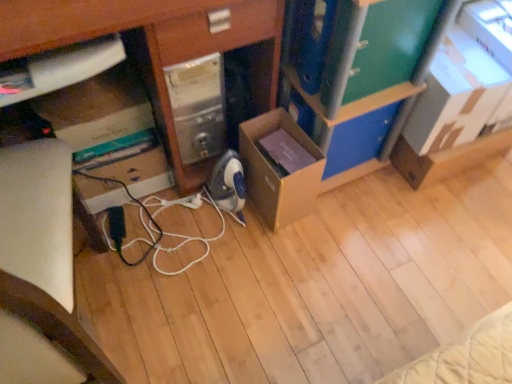
Question: Is point (343, 170) closer or farther from the camera than point (409, 84)?

Choices:
 (A) farther
 (B) closer

Answer: (A)

Question: In the image, is blue plastic drawer at center, which ranks as the second drawer in top-to-bottom order, on the left side or the right side of green matte bookshelf at upper right?

Choices:
 (A) right
 (B) left

Answer: (A)

Question: Estimate the real-world distances between objects in this image. Which object is closer to the black rubber cable at center?

Choices:
 (A) brown cardboard box at center, positioned as the second cardboard box in right-to-left order
 (B) blue plastic drawer at center, the second drawer from the front
 (C) matte cardboard box at lower left
 (D) cardboard box at upper right, the first cardboard box from the right
 (E) green matte bookshelf at upper right

Answer: (A)

Question: Which of these objects is positioned farthest from the blue plastic drawer at center, the second drawer from the front?

Choices:
 (A) green matte bookshelf at upper right
 (B) black rubber cable at center
 (C) matte cardboard box at lower left
 (D) green matte drawer at upper right, the 2th drawer when ordered from bottom to top
 (E) brown cardboard box at center, the 1th cardboard box viewed from the left

Answer: (B)